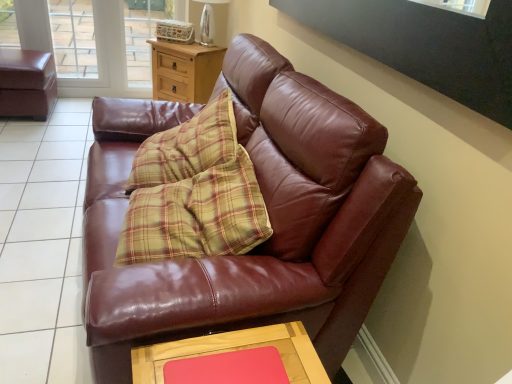
In order to click on free space above wooden table at lower center (from a real-world perspective) in this screenshot , I will do `click(238, 356)`.